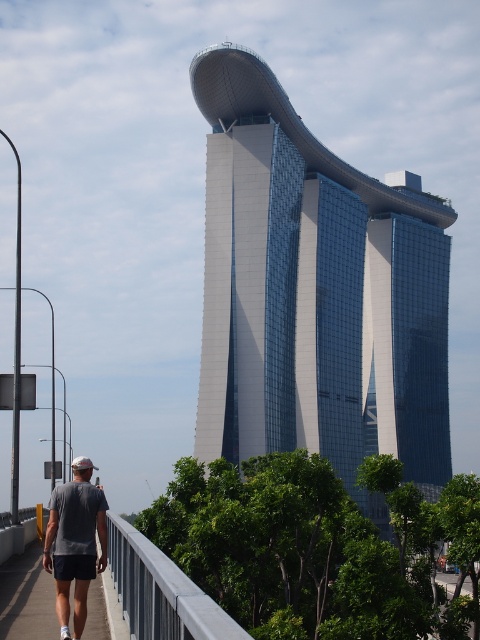
The height and width of the screenshot is (640, 480). Find the location of `gray metallic rail at lower center`. gray metallic rail at lower center is located at coordinates (160, 592).

Is gray metallic rail at lower center to the right of gray concrete sidewalk at lower left from the viewer's perspective?

Yes, gray metallic rail at lower center is to the right of gray concrete sidewalk at lower left.

Does point (113, 577) come closer to viewer compared to point (7, 624)?

No.

Find the location of a particular element. gray metallic rail at lower center is located at coordinates (160, 592).

Can you confirm if gray fabric shirt at lower left is smaller than gray concrete sidewalk at lower left?

Incorrect, gray fabric shirt at lower left is not smaller in size than gray concrete sidewalk at lower left.

The height and width of the screenshot is (640, 480). I want to click on gray fabric shirt at lower left, so click(x=74, y=545).

Which is below, gray concrete sidewalk at lower left or white fabric baseball cap at lower left?

Positioned lower is white fabric baseball cap at lower left.

Can you confirm if gray concrete sidewalk at lower left is shorter than white fabric baseball cap at lower left?

Correct, gray concrete sidewalk at lower left is not as tall as white fabric baseball cap at lower left.

The width and height of the screenshot is (480, 640). I want to click on gray concrete sidewalk at lower left, so click(26, 596).